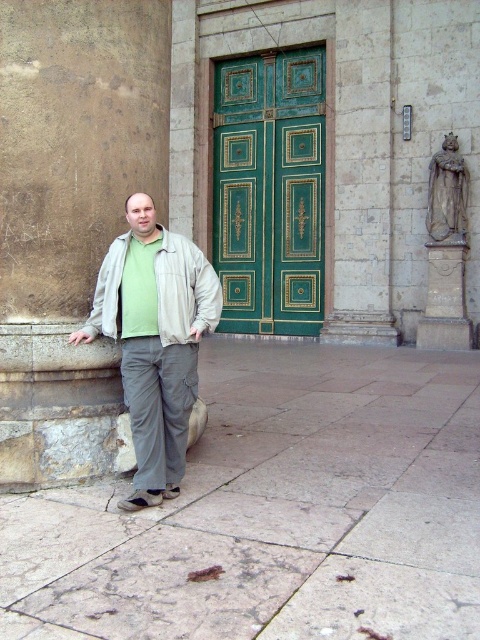
Question: Which point is farther to the camera?

Choices:
 (A) light gray cotton pants at center
 (B) gray stone pavement at lower center

Answer: (A)

Question: Which object is positioned closest to the beige fabric jacket at center?

Choices:
 (A) green polished wood door at center
 (B) light gray cotton pants at center
 (C) gray stone pavement at lower center

Answer: (B)

Question: Which of the following is the closest to the observer?

Choices:
 (A) green polished wood door at center
 (B) beige fabric jacket at center
 (C) light gray cotton pants at center
 (D) gray stone pavement at lower center

Answer: (D)

Question: Can you confirm if green polished wood door at center is bigger than beige fabric jacket at center?

Choices:
 (A) yes
 (B) no

Answer: (B)

Question: Can you confirm if green polished wood door at center is positioned below light gray cotton pants at center?

Choices:
 (A) yes
 (B) no

Answer: (B)

Question: Does green polished wood door at center have a greater width compared to beige fabric jacket at center?

Choices:
 (A) yes
 (B) no

Answer: (B)